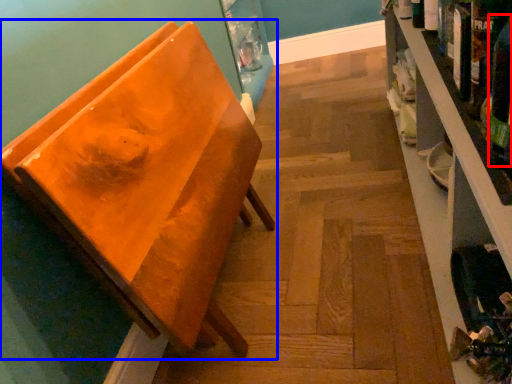
Question: Which point is further to the camera, beer bottle (highlighted by a red box) or furniture (highlighted by a blue box)?

Choices:
 (A) beer bottle
 (B) furniture

Answer: (B)